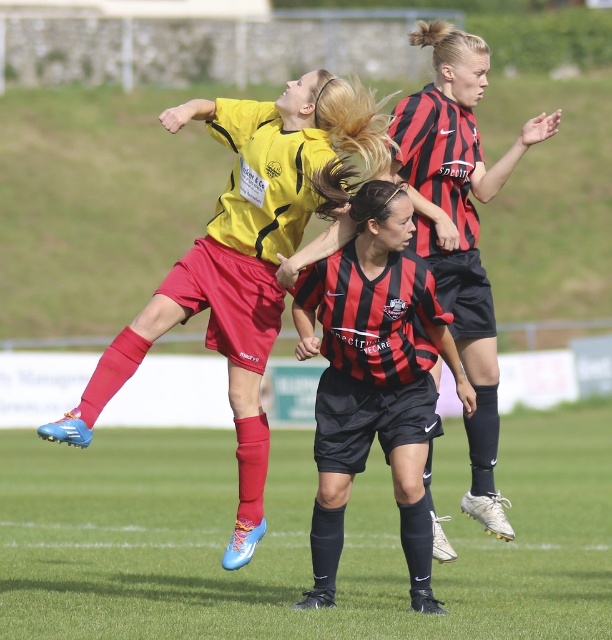
You are a referee observing the soccer match. You need to determine which player is shorter between the black matte soccer jersey at center and the black and red striped jersey at upper right. Which one is shorter?

The black matte soccer jersey at center is shorter than the black and red striped jersey at upper right.

You are a soccer coach analyzing the positions of two key players during a match. The first player is at point (323, 320) and the second is at point (441, 170). Based on their positions, which player is positioned further back from the goal?

Point (323, 320) is behind point (441, 170), so the first player at point (323, 320) is positioned further back from the goal.

You are a soccer referee observing the play. You need to determine which player is closer to the left side of the field. Which player is positioned more to the left between the matte yellow jersey at upper center and the black and red striped jersey at upper right?

The matte yellow jersey at upper center is positioned more to the left compared to the black and red striped jersey at upper right, as it is on the left side of the latter.